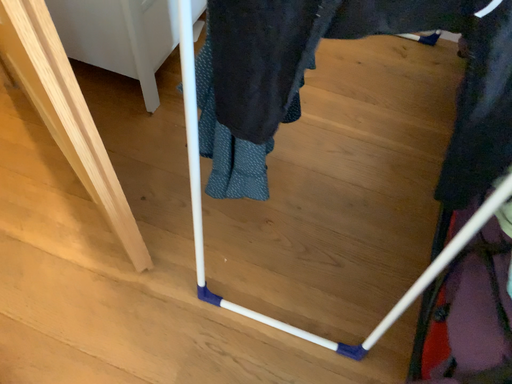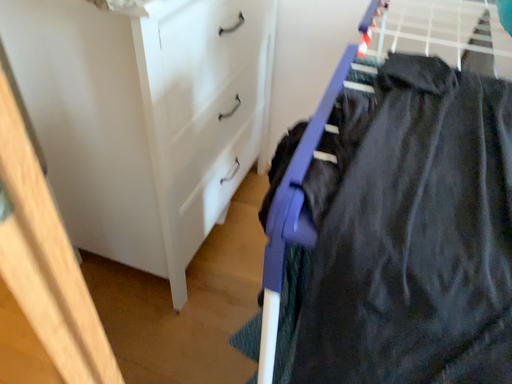
Question: Which way did the camera rotate in the video?

Choices:
 (A) rotated upward
 (B) rotated downward

Answer: (A)